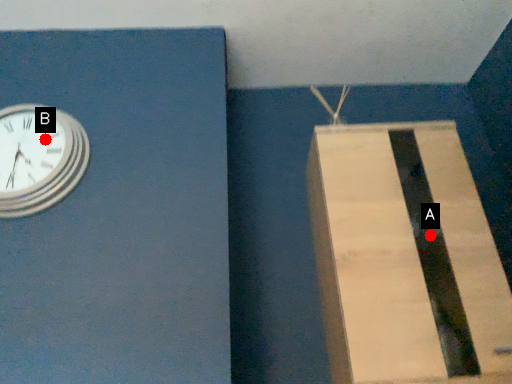
Question: Two points are circled on the image, labeled by A and B beside each circle. Which of the following is the closest to the observer?

Choices:
 (A) A is closer
 (B) B is closer

Answer: (B)